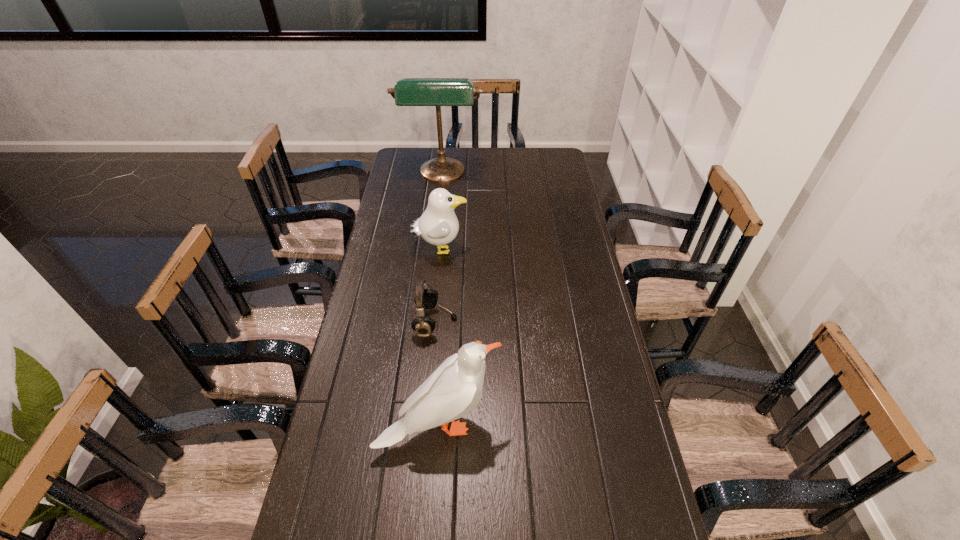
This screenshot has height=540, width=960. Identify the location of object that is positioned at the far edge. (437, 92).

Where is `table lamp at the left edge`? The image size is (960, 540). table lamp at the left edge is located at coordinates (437, 92).

Identify the location of object that is at the far left corner. (437, 92).

Locate an element on the screen. Image resolution: width=960 pixels, height=540 pixels. vacant space at the far edge is located at coordinates (517, 161).

Where is `vacant region at the left edge`? vacant region at the left edge is located at coordinates (360, 466).

Where is `free space at the right edge of the desktop`? free space at the right edge of the desktop is located at coordinates (650, 498).

Find the location of a particular element. vacant area that lies between the farther gull and the third farthest object is located at coordinates (438, 286).

Locate an element on the screen. This screenshot has width=960, height=540. free area in between the farther gull and the shortest object is located at coordinates (438, 286).

Where is `unoccupied area between the nearest object and the tallest object`? This screenshot has height=540, width=960. unoccupied area between the nearest object and the tallest object is located at coordinates (441, 300).

Image resolution: width=960 pixels, height=540 pixels. Find the location of `vacant space that is in between the tallest object and the nearest object`. vacant space that is in between the tallest object and the nearest object is located at coordinates (441, 300).